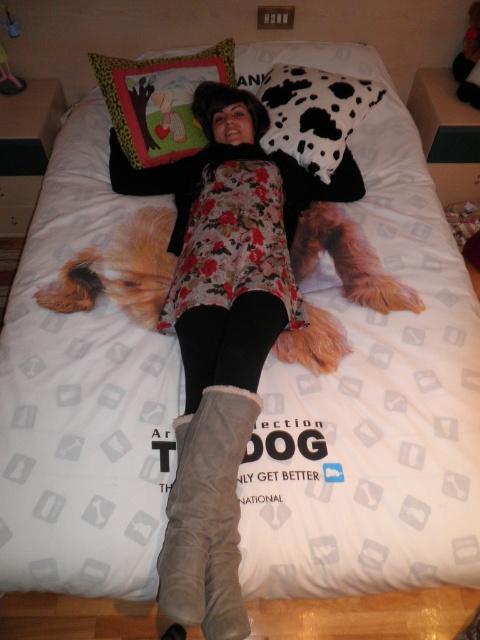
Is leopard print fabric pillow at upper left shorter than cow print fabric pillow at center?

No.

Can you confirm if leopard print fabric pillow at upper left is wider than cow print fabric pillow at center?

Yes.

Does point (152, 64) come farther from viewer compared to point (328, 74)?

That is False.

Locate an element on the screen. leopard print fabric pillow at upper left is located at coordinates (159, 100).

Who is positioned more to the left, suede boots at lower center or cow print fabric pillow at center?

suede boots at lower center

Who is lower down, suede boots at lower center or cow print fabric pillow at center?

suede boots at lower center is lower down.

Does point (232, 451) lie behind point (286, 122)?

No, it is not.

Identify the location of suede boots at lower center. This screenshot has width=480, height=640. (206, 516).

This screenshot has width=480, height=640. What do you see at coordinates (217, 340) in the screenshot?
I see `fluffy suede boots at center` at bounding box center [217, 340].

Is fluffy suede boots at center shorter than cow print fabric pillow at center?

No, fluffy suede boots at center is not shorter than cow print fabric pillow at center.

Who is more distant from viewer, (232, 426) or (276, 104)?

The point (276, 104) is more distant.

Find the location of `fluffy suede boots at center`. fluffy suede boots at center is located at coordinates (217, 340).